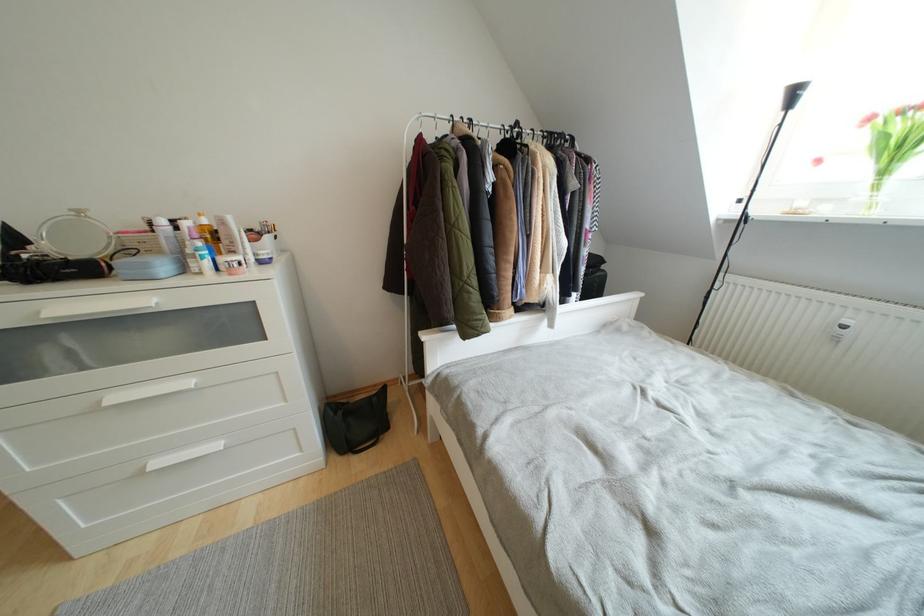
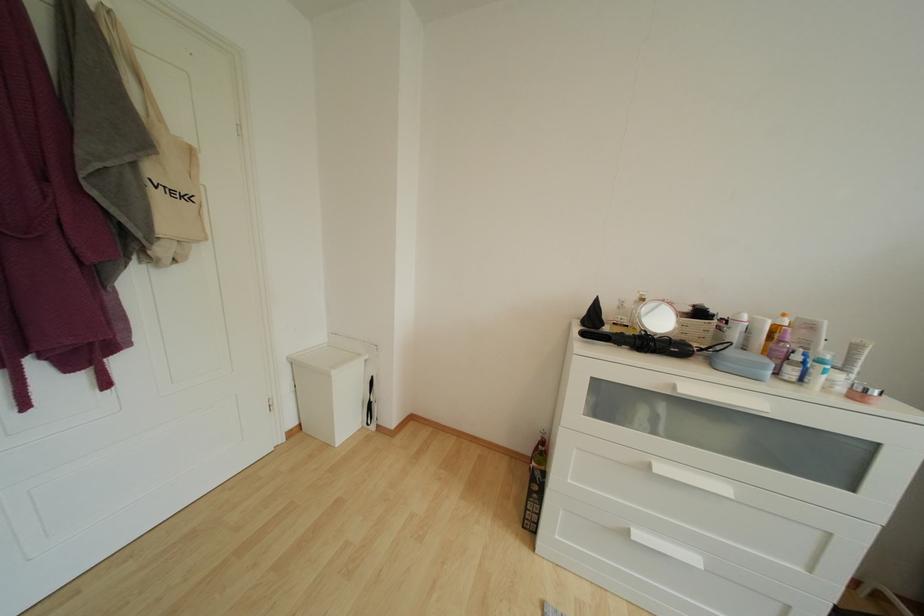
Locate, in the second image, the point that corresponds to the point at 209,225 in the first image.

(789, 326)